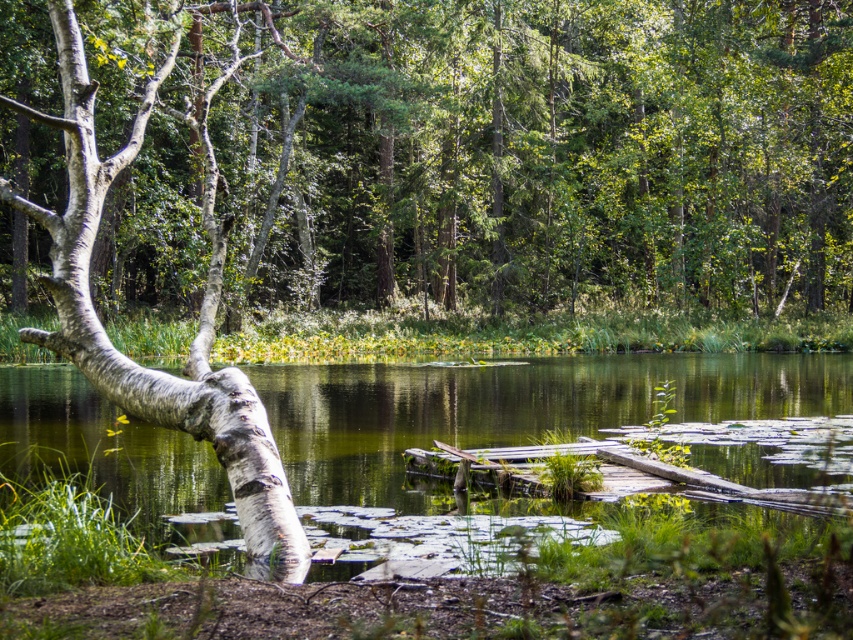
You are navigating through the forest and come across two points marked in the scene. The first point is at coordinate point (132,401) and the second is at point (258,452). Which point is closer to the birch tree with white bark that is leaning towards the water?

Point (258,452) is closer to the birch tree with white bark leaning towards the water because it is in front of point (132,401), which is behind it.

You are standing at the center of the forest and see a point marked at coordinates (529, 148). Which object in the scene is this point located on?

The point at coordinates (529, 148) is located on the white bark tree at left.